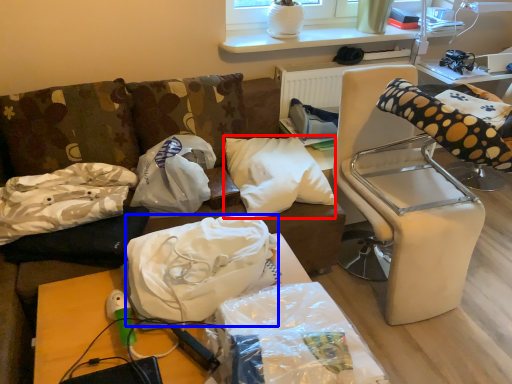
Question: Which point is closer to the camera, pillow (highlighted by a red box) or material (highlighted by a blue box)?

Choices:
 (A) pillow
 (B) material

Answer: (B)